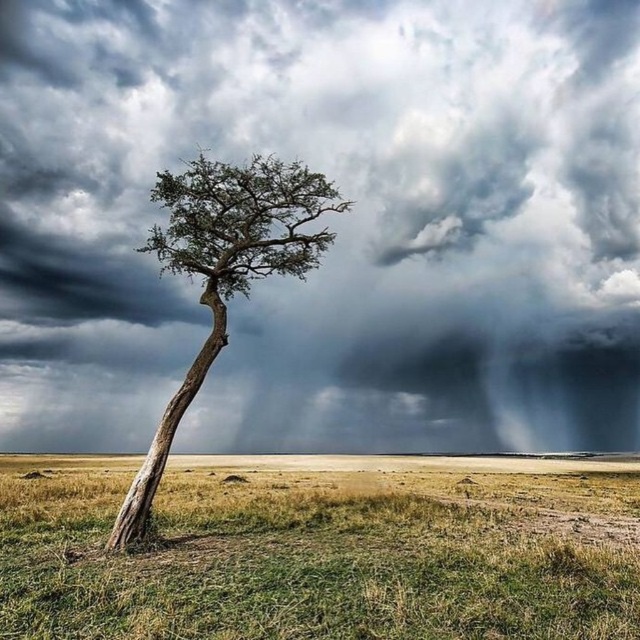
Question: Which object is the farthest from the green grass at center?

Choices:
 (A) green textured tree at center
 (B) dark gray cloud at upper center

Answer: (B)

Question: Where is green grass at center located in relation to green textured tree at center in the image?

Choices:
 (A) left
 (B) right

Answer: (A)

Question: Which is farther from the dark gray cloud at upper center?

Choices:
 (A) green grass at center
 (B) green textured tree at center

Answer: (A)

Question: Does dark gray cloud at upper center have a smaller size compared to green textured tree at center?

Choices:
 (A) no
 (B) yes

Answer: (A)

Question: Which object is closer to the camera taking this photo?

Choices:
 (A) dark gray cloud at upper center
 (B) green textured tree at center
 (C) green grass at center

Answer: (C)

Question: Does dark gray cloud at upper center appear on the right side of green textured tree at center?

Choices:
 (A) yes
 (B) no

Answer: (A)